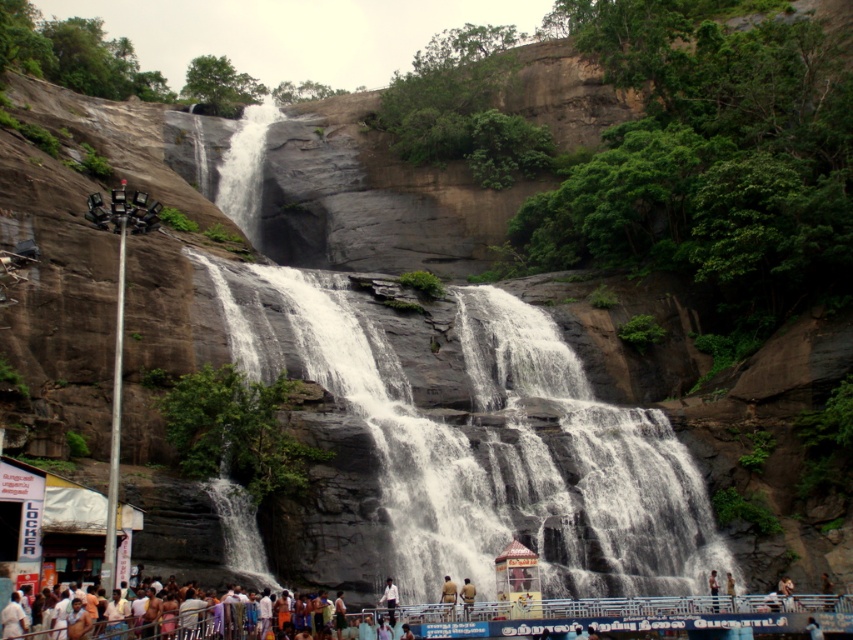
In the scene shown: You are standing at the base of the waterfall and notice a point marked at coordinates (467, 596). Based on the scene description, what is the most likely material or object located at this point?

The point at coordinates (467, 596) corresponds to light brown skin at lower center, which is likely part of a person or animal near the base of the waterfall.

You are standing at a viewpoint overlooking the waterfall. You notice two points marked in the scene. The first point is at coordinate point (444,577) and the second is at point (825,588). Which of these points is physically closer to your current position?

Point (444,577) is closer to the camera than point (825,588), so the first point is closer to your current position.

You are standing at the base of the waterfall and see the white cotton clothing at lower center. If you want to reach it, which direction should you move relative to the waterfall?

The white cotton clothing at lower center is located at point coordinates 0.975 on the x axis and 0.219 on the y axis. Since the clothing is at lower center, you should move towards the bottom middle area of the waterfall to reach it.